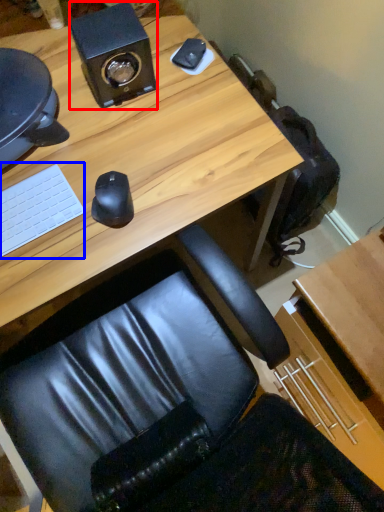
Question: Which object appears closest to the camera in this image, speaker (highlighted by a red box) or laptop keyboard (highlighted by a blue box)?

Choices:
 (A) speaker
 (B) laptop keyboard

Answer: (B)